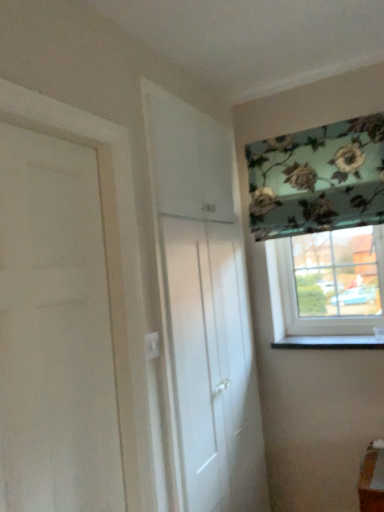
Question: Considering the relative sizes of clear glass window at right, the second window in the top-to-bottom sequence, and white matte door at left, positioned as the first door in front-to-back order, in the image provided, is clear glass window at right, the second window in the top-to-bottom sequence, taller than white matte door at left, positioned as the first door in front-to-back order,?

Choices:
 (A) no
 (B) yes

Answer: (A)

Question: Is clear glass window at right, placed as the 1th window when sorted from bottom to top, to the right of white matte door at left, acting as the 2th door starting from the right, from the viewer's perspective?

Choices:
 (A) no
 (B) yes

Answer: (B)

Question: Does clear glass window at right, the second window in the top-to-bottom sequence, come behind white matte door at left, the first door when ordered from left to right?

Choices:
 (A) yes
 (B) no

Answer: (A)

Question: Is clear glass window at right, placed as the 1th window when sorted from bottom to top, thinner than white matte door at left, which is counted as the second door, starting from the back?

Choices:
 (A) no
 (B) yes

Answer: (A)

Question: Is clear glass window at right, the second window in the top-to-bottom sequence, aimed at white matte door at left, which is counted as the second door, starting from the back?

Choices:
 (A) no
 (B) yes

Answer: (B)

Question: Which is correct: white glossy cabinet at center, marked as the 2th door in a left-to-right arrangement, is inside white matte door at left, acting as the 2th door starting from the right, or outside of it?

Choices:
 (A) outside
 (B) inside

Answer: (A)

Question: From the image's perspective, is white glossy cabinet at center, positioned as the 1th door in back-to-front order, located above or below white matte door at left, acting as the 2th door starting from the right?

Choices:
 (A) above
 (B) below

Answer: (B)

Question: Is point (218, 158) closer or farther from the camera than point (11, 480)?

Choices:
 (A) closer
 (B) farther

Answer: (B)

Question: From their relative heights in the image, would you say white glossy cabinet at center, which ranks as the 1th door in right-to-left order, is taller or shorter than white matte door at left, acting as the 2th door starting from the right?

Choices:
 (A) short
 (B) tall

Answer: (B)

Question: Considering the positions of floral fabric at upper right, positioned as the first window in top-to-bottom order, and white glossy cabinet at center, which ranks as the 1th door in right-to-left order, in the image, is floral fabric at upper right, positioned as the first window in top-to-bottom order, taller or shorter than white glossy cabinet at center, which ranks as the 1th door in right-to-left order,?

Choices:
 (A) tall
 (B) short

Answer: (B)

Question: From the image's perspective, relative to white glossy cabinet at center, which ranks as the 1th door in right-to-left order, is floral fabric at upper right, placed as the second window when sorted from bottom to top, above or below?

Choices:
 (A) below
 (B) above

Answer: (B)

Question: From a real-world perspective, is floral fabric at upper right, positioned as the first window in top-to-bottom order, above or below white glossy cabinet at center, positioned as the 1th door in back-to-front order?

Choices:
 (A) below
 (B) above

Answer: (B)

Question: Considering the relative positions of floral fabric at upper right, placed as the second window when sorted from bottom to top, and white glossy cabinet at center, positioned as the 1th door in back-to-front order, in the image provided, is floral fabric at upper right, placed as the second window when sorted from bottom to top, to the left or to the right of white glossy cabinet at center, positioned as the 1th door in back-to-front order,?

Choices:
 (A) left
 (B) right

Answer: (B)

Question: Considering the positions of black marble window sill at lower right and clear glass window at right, the second window in the top-to-bottom sequence, in the image, is black marble window sill at lower right wider or thinner than clear glass window at right, the second window in the top-to-bottom sequence,?

Choices:
 (A) thin
 (B) wide

Answer: (B)

Question: Is black marble window sill at lower right taller or shorter than clear glass window at right, the second window in the top-to-bottom sequence?

Choices:
 (A) short
 (B) tall

Answer: (A)